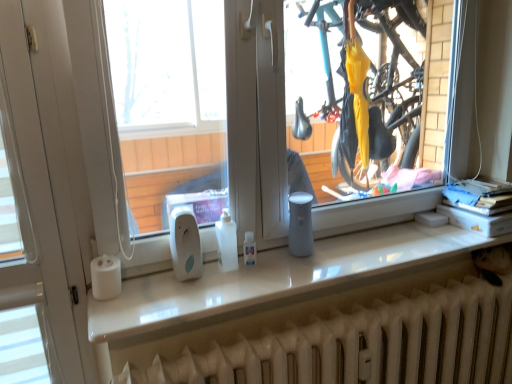
Question: From a real-world perspective, is white glossy counter top at center positioned above or below white matte paper towel at left?

Choices:
 (A) above
 (B) below

Answer: (B)

Question: Considering the positions of point (221, 304) and point (113, 281), is point (221, 304) closer or farther from the camera than point (113, 281)?

Choices:
 (A) farther
 (B) closer

Answer: (B)

Question: Which is farther from the white matte paper towel at left?

Choices:
 (A) white matte radiator at lower center
 (B) white glossy counter top at center

Answer: (A)

Question: Which is farther from the white matte paper towel at left?

Choices:
 (A) white matte radiator at lower center
 (B) white glossy counter top at center

Answer: (A)